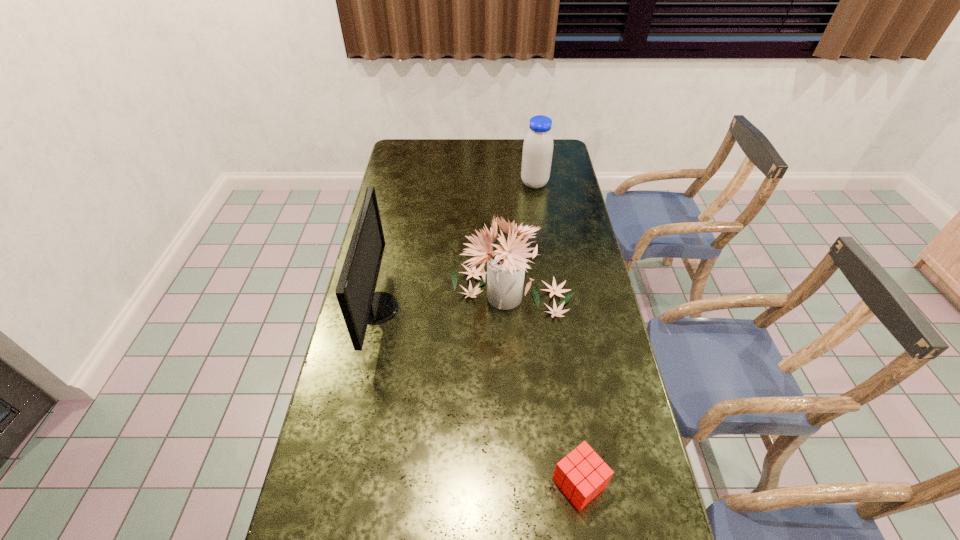
Find the location of a particular element. This screenshot has height=540, width=960. the leftmost object is located at coordinates (359, 303).

You are a GUI agent. You are given a task and a screenshot of the screen. Output one action in this format:
    pyautogui.click(x=<x>, y=<y>)
    Task: Click on the bouquet
    
    Given the screenshot: What is the action you would take?
    pyautogui.click(x=506, y=264)

This screenshot has height=540, width=960. I want to click on the farthest object, so click(537, 153).

Where is `cube`? cube is located at coordinates (581, 475).

Locate an element on the screen. The height and width of the screenshot is (540, 960). the nearest object is located at coordinates (581, 475).

Where is `vacant area situated on the front-facing side of the leftmost object`? The width and height of the screenshot is (960, 540). vacant area situated on the front-facing side of the leftmost object is located at coordinates (508, 308).

At what (x,y) coordinates should I click in order to perform the action: click on blank space located on the back of the bouquet. Please return your answer as a coordinate pair (x, y). The width and height of the screenshot is (960, 540). Looking at the image, I should click on (508, 220).

Where is `vacant position located on the left of the soya milk`? Image resolution: width=960 pixels, height=540 pixels. vacant position located on the left of the soya milk is located at coordinates (490, 184).

Where is `vacant space located on the left of the cube`? The width and height of the screenshot is (960, 540). vacant space located on the left of the cube is located at coordinates (445, 483).

At what (x,y) coordinates should I click in order to perform the action: click on object that is at the left edge. Please return your answer as a coordinate pair (x, y). Looking at the image, I should click on (359, 303).